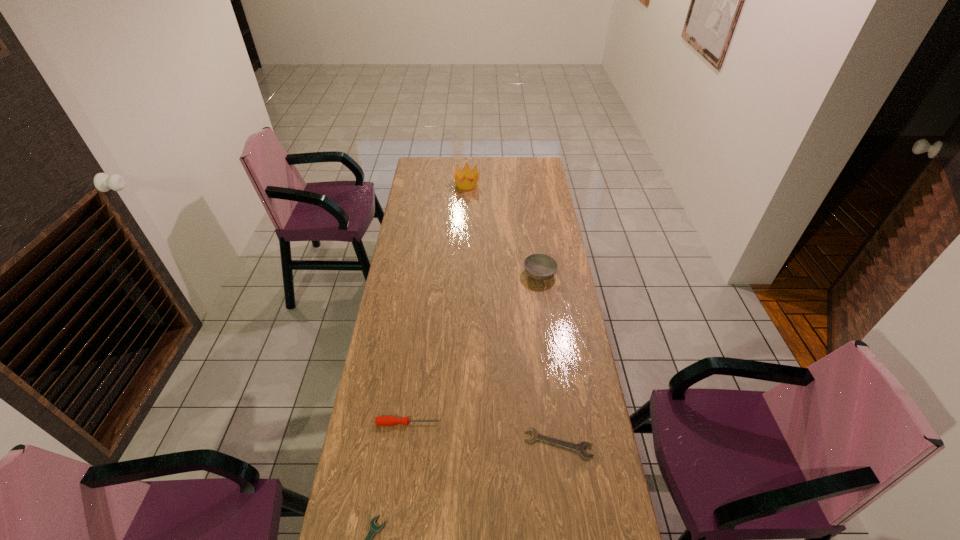
This screenshot has width=960, height=540. Find the location of `empty space between the farthest object and the second nearest object`. empty space between the farthest object and the second nearest object is located at coordinates (513, 314).

The image size is (960, 540). Find the location of `vacant space that is in between the fourth nearest object and the third shortest object`. vacant space that is in between the fourth nearest object and the third shortest object is located at coordinates click(x=474, y=348).

This screenshot has width=960, height=540. In order to click on free space between the crown and the third tallest object in this screenshot , I will do `click(438, 303)`.

Find the location of a particular element. Image resolution: width=960 pixels, height=540 pixels. vacant region between the tallest object and the bowl is located at coordinates (503, 229).

In order to click on vacant space that's between the tallest object and the bowl in this screenshot , I will do `click(503, 229)`.

Find the location of a particular element. vacant space in between the farthest object and the right wrench is located at coordinates (513, 314).

Identify which object is the second nearest to the third farthest object. Please provide its 2D coordinates. Your answer should be formatted as a tuple, i.e. [(x, y)], where the tuple contains the x and y coordinates of a point satisfying the conditions above.

[(580, 447)]

Where is `object that stands as the third closest to the bowl`? The width and height of the screenshot is (960, 540). object that stands as the third closest to the bowl is located at coordinates (380, 420).

At what (x,y) coordinates should I click in order to perform the action: click on vacant space that satisfies the following two spatial constraints: 1. on the back side of the farther wrench; 2. at the tip of the third tallest object. Please return your answer as a coordinate pair (x, y). Looking at the image, I should click on (556, 423).

You are a GUI agent. You are given a task and a screenshot of the screen. Output one action in this format:
    pyautogui.click(x=<x>, y=<y>)
    Task: Click on the vacant point that satisfies the following two spatial constraints: 1. at the tip of the right wrench; 2. on the left side of the third tallest object
    The height and width of the screenshot is (540, 960).
    Given the screenshot: What is the action you would take?
    pyautogui.click(x=405, y=444)